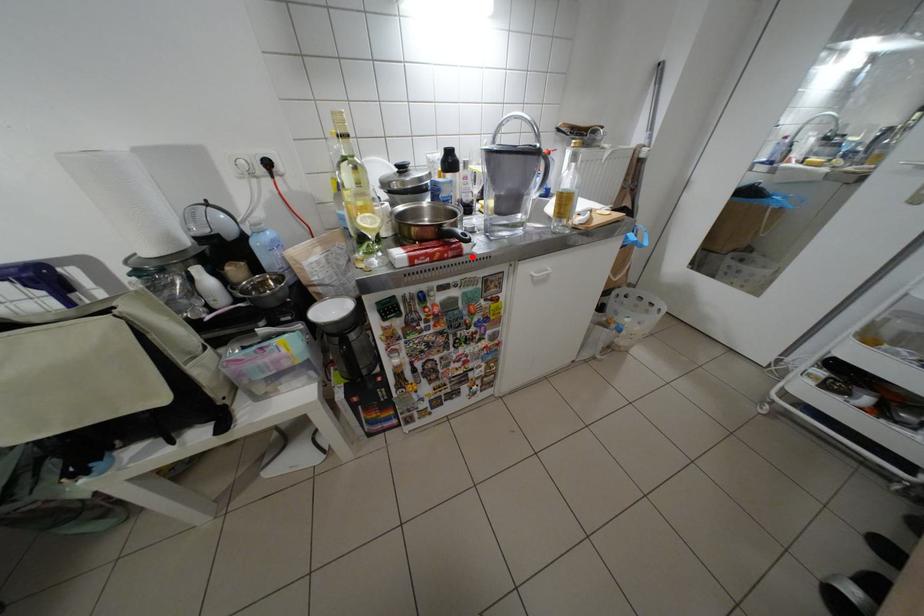
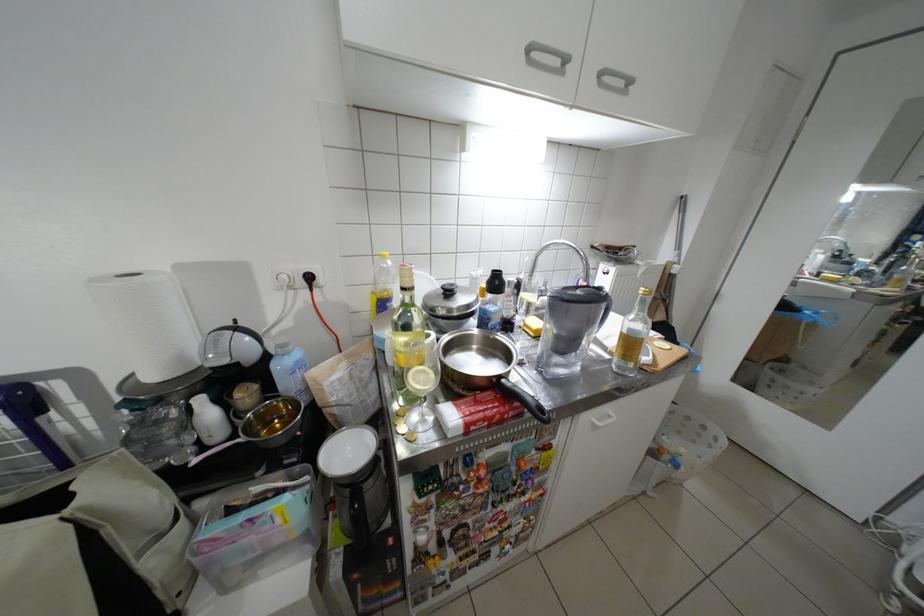
Question: I am providing you with two images of the same scene from different viewpoints. A red point is shown in image1. For the corresponding object point in image2, is it positioned nearer or farther from the camera?

Choices:
 (A) Nearer
 (B) Farther

Answer: (B)